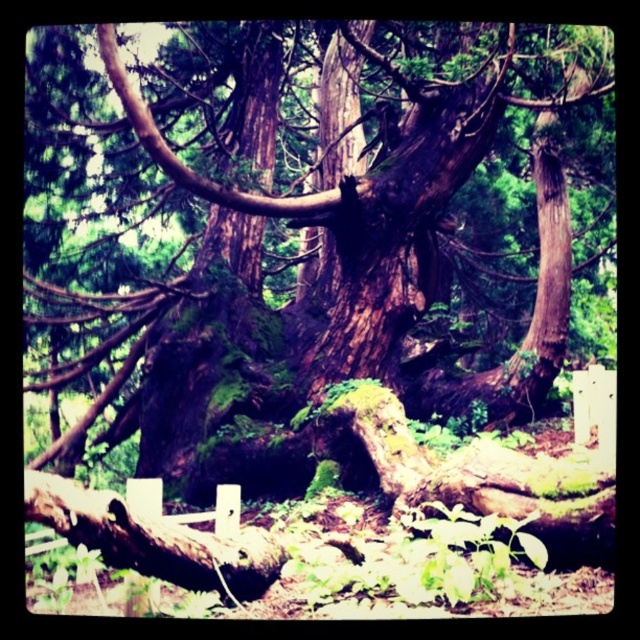
Question: Which of the following is the farthest from the observer?

Choices:
 (A) (536, 152)
 (B) (380, 211)

Answer: (A)

Question: From the image, what is the correct spatial relationship of dark brown bark tree at center in relation to brown rough tree trunk at center?

Choices:
 (A) above
 (B) below

Answer: (A)

Question: In this image, where is dark brown bark tree at center located relative to brown rough tree trunk at center?

Choices:
 (A) below
 (B) above

Answer: (B)

Question: Among these objects, which one is nearest to the camera?

Choices:
 (A) brown rough tree trunk at center
 (B) dark brown bark tree at center

Answer: (B)

Question: Among these points, which one is farthest from the camera?

Choices:
 (A) (557, 294)
 (B) (173, 144)

Answer: (B)

Question: Does dark brown bark tree at center appear under brown rough tree trunk at center?

Choices:
 (A) no
 (B) yes

Answer: (A)